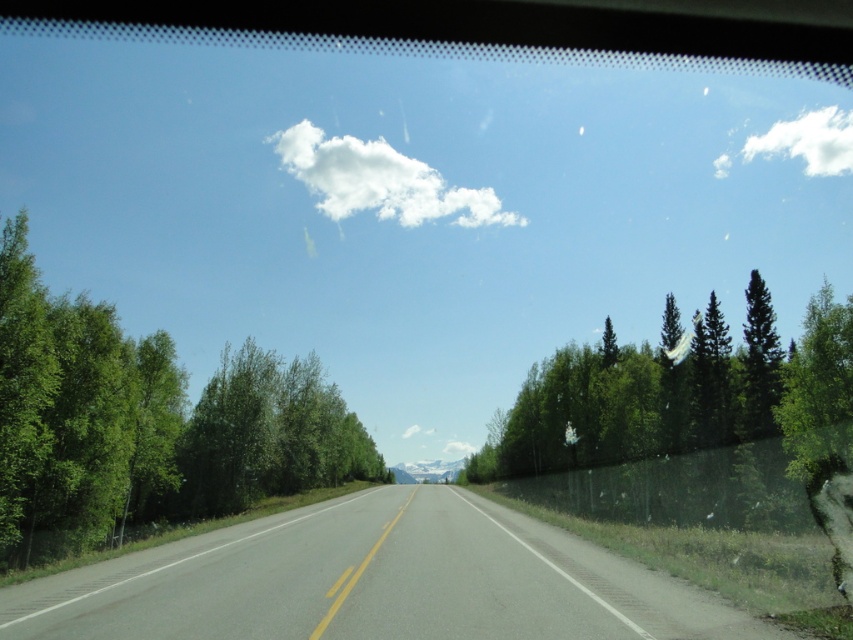
Question: Can you confirm if asphalt road at center is positioned to the right of white fluffy cloud at upper center?

Choices:
 (A) yes
 (B) no

Answer: (A)

Question: Is green matte trees at right in front of white fluffy cloud at upper right?

Choices:
 (A) no
 (B) yes

Answer: (B)

Question: Which of the following is the farthest from the observer?

Choices:
 (A) (836, 168)
 (B) (373, 509)
 (C) (306, 166)
 (D) (755, 381)

Answer: (A)

Question: Which point is closer to the camera taking this photo?

Choices:
 (A) (717, 164)
 (B) (51, 513)
 (C) (51, 616)

Answer: (C)

Question: Is asphalt road at center behind green matte trees at right?

Choices:
 (A) no
 (B) yes

Answer: (A)

Question: Which point is closer to the camera taking this photo?

Choices:
 (A) (283, 490)
 (B) (473, 465)

Answer: (A)